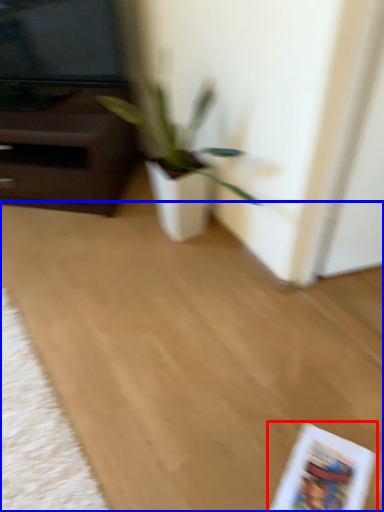
Question: Which point is closer to the camera, paperback book (highlighted by a red box) or plain (highlighted by a blue box)?

Choices:
 (A) paperback book
 (B) plain

Answer: (B)